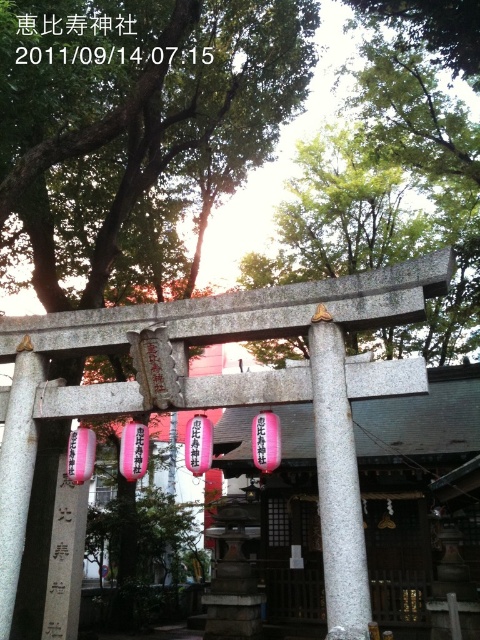
You are standing at the entrance of the Ebisu Shrine and notice the gray granite pole at center and the black paper at upper center. Which object is positioned closer to you?

The gray granite pole at center is closer to the viewer than the black paper at upper center.

Consider the image. You are a visitor at the Ebisu Shrine and want to take a photo of the gray granite pole at center and the black stone sign at center. Which object should you zoom in on to ensure both are in the frame without cropping?

You should zoom in on the black stone sign at center because its smaller width allows both objects to fit in the frame without cropping.